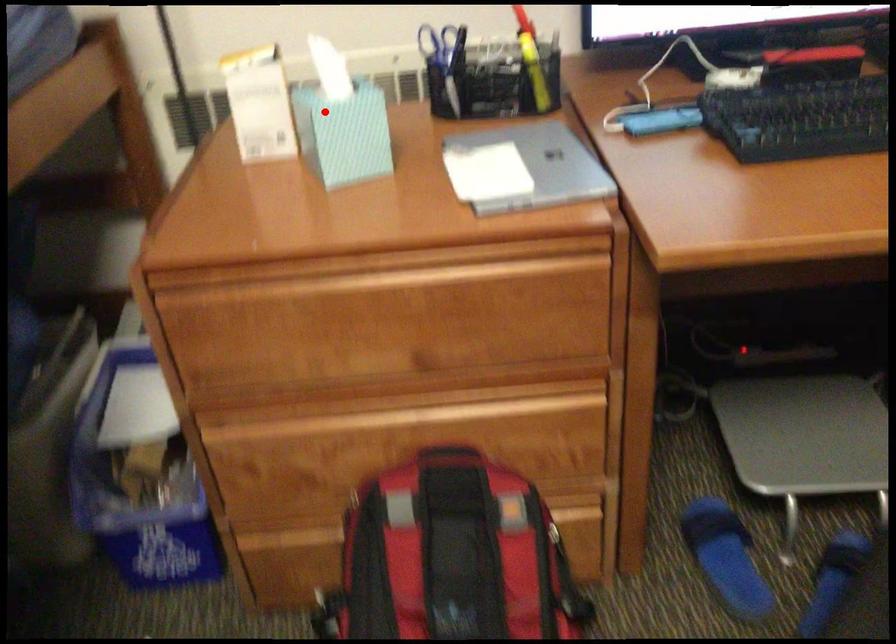
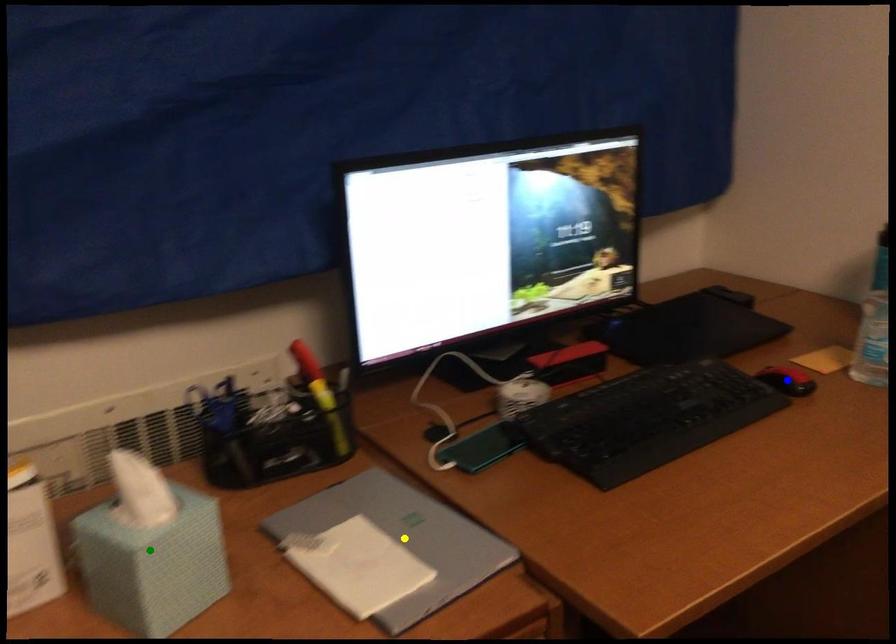
Question: I am providing you with two images of the same scene from different viewpoints. A red point is marked on the first image. You are given multiple points on the second image. Which point in image 2 represents the same 3d spot as the red point in image 1?

Choices:
 (A) green point
 (B) yellow point
 (C) blue point

Answer: (A)